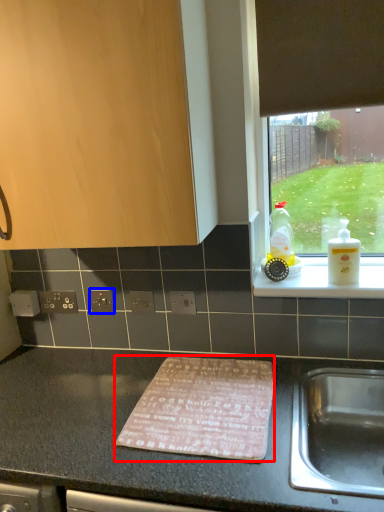
Question: Among these objects, which one is nearest to the camera, mat (highlighted by a red box) or electric outlet (highlighted by a blue box)?

Choices:
 (A) mat
 (B) electric outlet

Answer: (A)